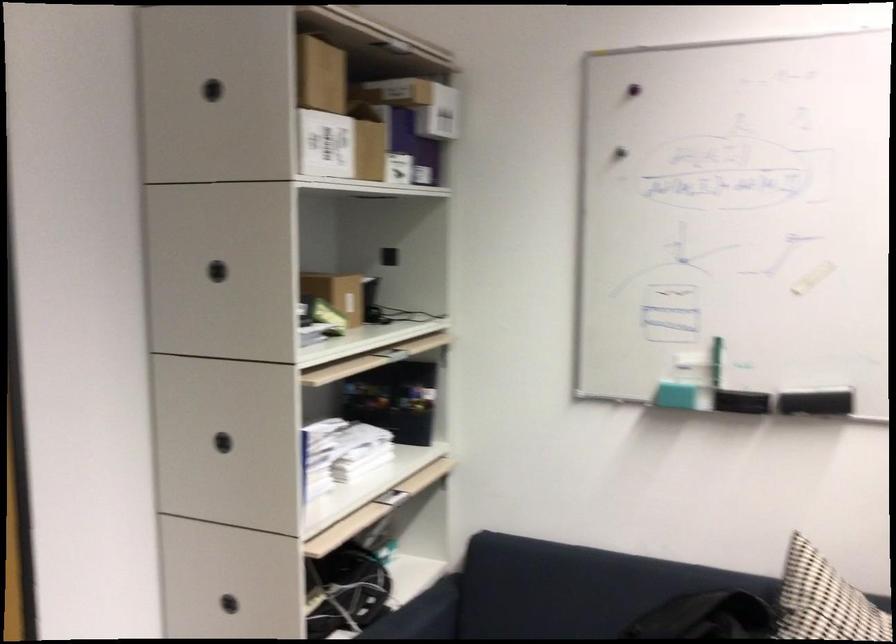
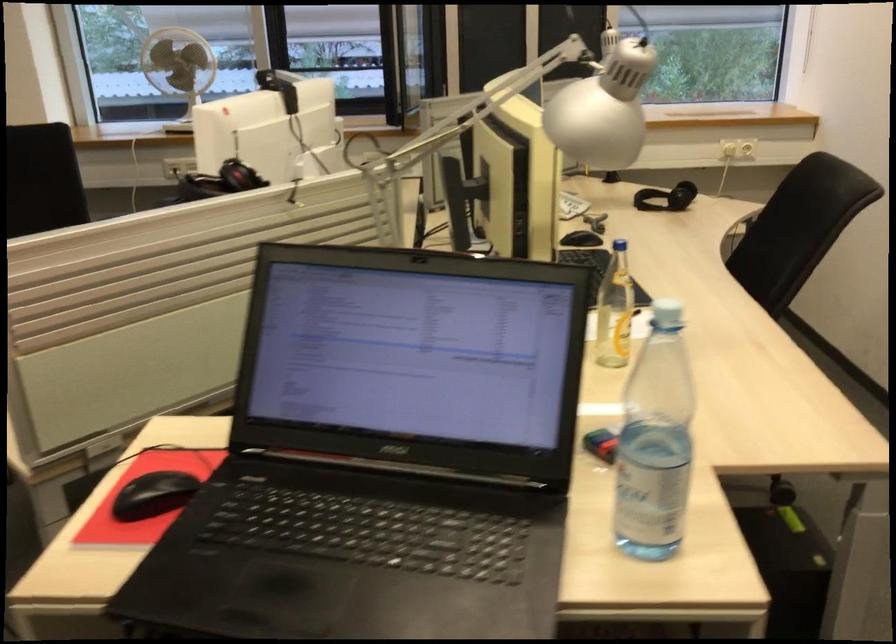
The first image is from the beginning of the video and the second image is from the end. How did the camera likely rotate when shooting the video?

The camera's rotation is toward right-down.